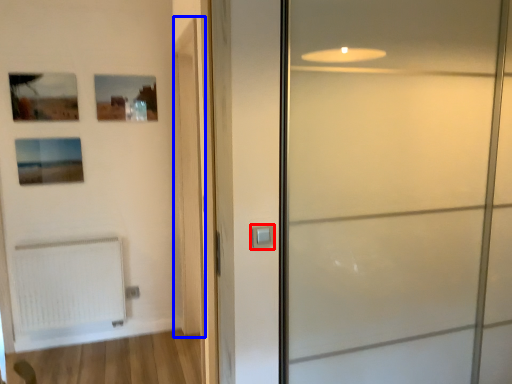
Question: Among these objects, which one is nearest to the camera, door handle (highlighted by a red box) or barn door (highlighted by a blue box)?

Choices:
 (A) door handle
 (B) barn door

Answer: (A)